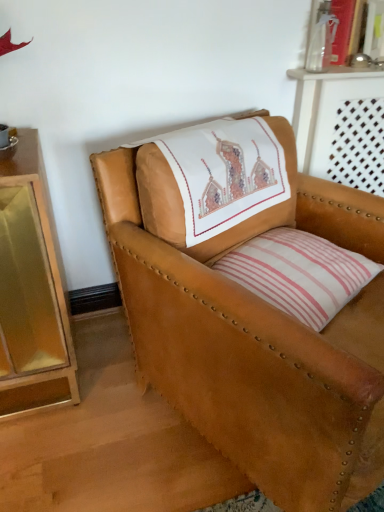
Question: Is tan leather chair at center positioned with its back to white striped pillow at center?

Choices:
 (A) no
 (B) yes

Answer: (B)

Question: Is tan leather chair at center facing towards white striped pillow at center?

Choices:
 (A) yes
 (B) no

Answer: (A)

Question: From the image's perspective, is tan leather chair at center above white striped pillow at center?

Choices:
 (A) yes
 (B) no

Answer: (B)

Question: Does tan leather chair at center have a lesser height compared to white striped pillow at center?

Choices:
 (A) no
 (B) yes

Answer: (A)

Question: Does tan leather chair at center contain white striped pillow at center?

Choices:
 (A) yes
 (B) no

Answer: (A)

Question: Considering the relative sizes of tan leather chair at center and white striped pillow at center in the image provided, is tan leather chair at center taller than white striped pillow at center?

Choices:
 (A) no
 (B) yes

Answer: (B)

Question: Does white striped pillow at center come behind tan leather chair at center?

Choices:
 (A) yes
 (B) no

Answer: (A)

Question: Is white striped pillow at center facing towards tan leather chair at center?

Choices:
 (A) no
 (B) yes

Answer: (B)

Question: Is white striped pillow at center smaller than tan leather chair at center?

Choices:
 (A) no
 (B) yes

Answer: (B)

Question: Is the depth of white striped pillow at center less than that of tan leather chair at center?

Choices:
 (A) yes
 (B) no

Answer: (B)

Question: Would you say white striped pillow at center contains tan leather chair at center?

Choices:
 (A) yes
 (B) no

Answer: (B)

Question: Considering the relative sizes of white striped pillow at center and tan leather chair at center in the image provided, is white striped pillow at center taller than tan leather chair at center?

Choices:
 (A) no
 (B) yes

Answer: (A)

Question: From a real-world perspective, is tan leather chair at center physically located above or below white striped pillow at center?

Choices:
 (A) above
 (B) below

Answer: (B)